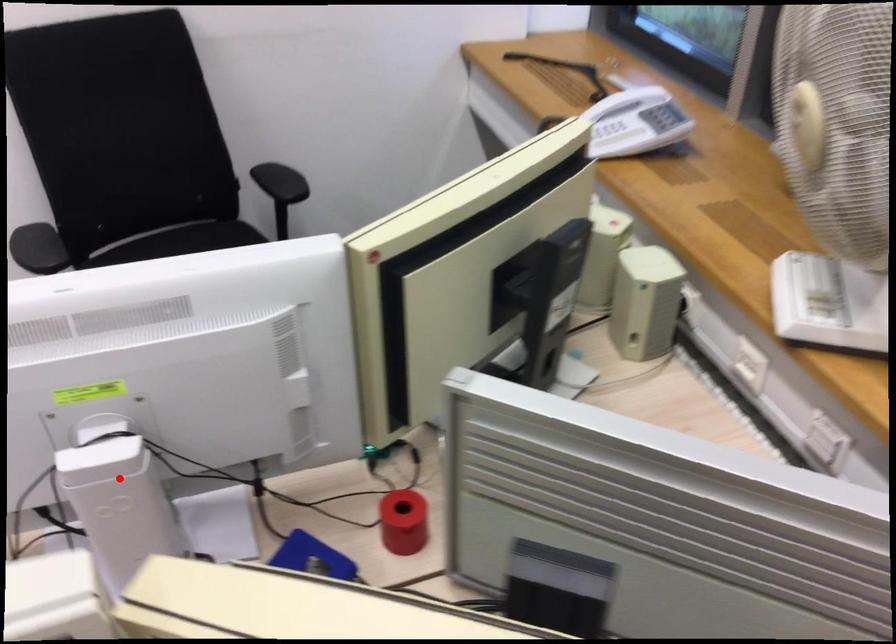
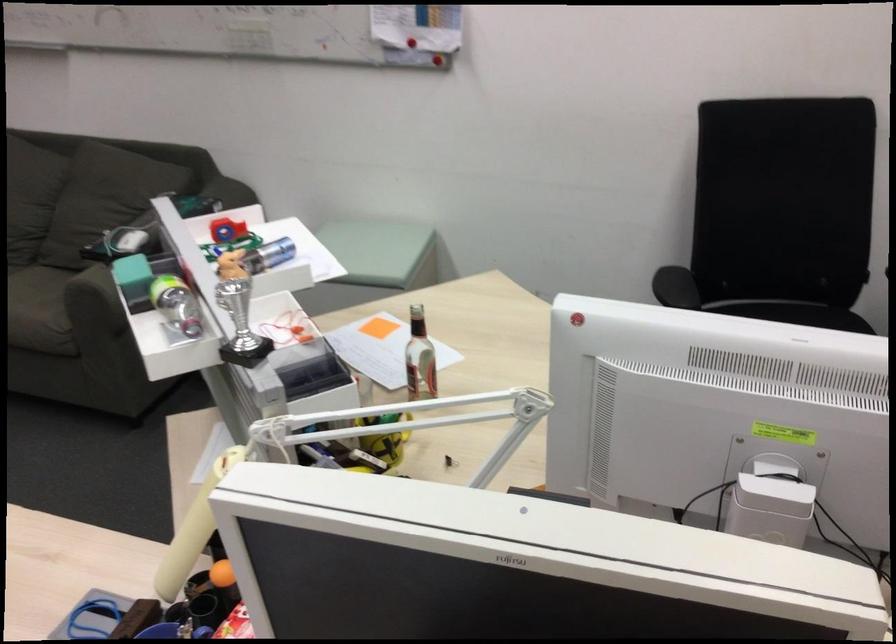
Where in the second image is the point corresponding to the highlighted location from the first image?

(770, 509)